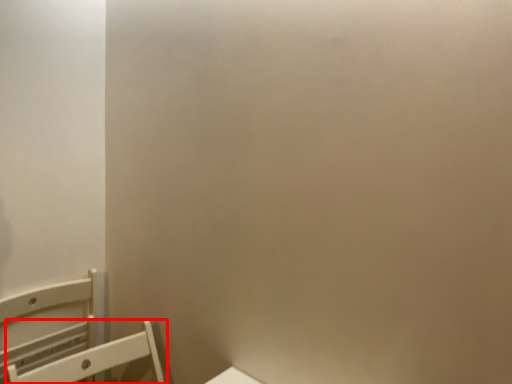
Question: From the image's perspective, where is furniture (annotated by the red box) located in relation to furniture in the image?

Choices:
 (A) below
 (B) above

Answer: (A)